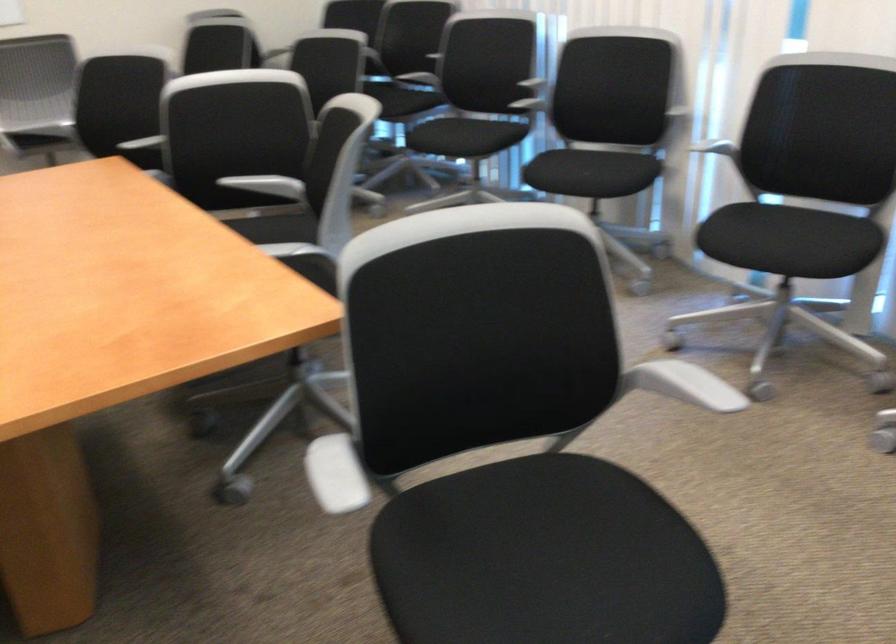
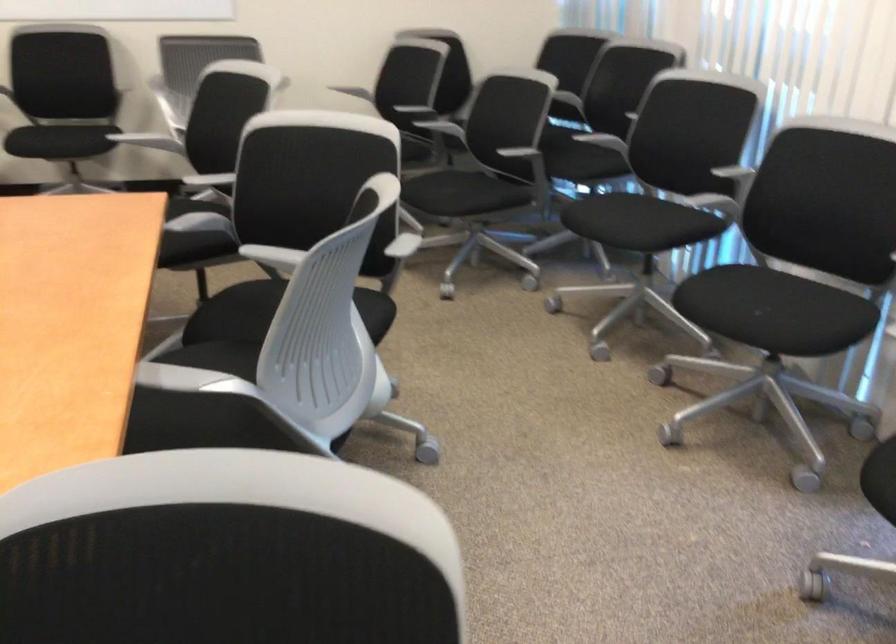
The point at [394,93] is marked in the first image. Where is the corresponding point in the second image?

(588, 147)